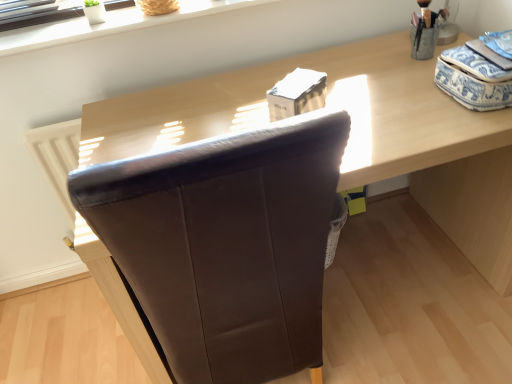
What are the coordinates of `free area below brown leather chair at center (from a real-world perspective)` in the screenshot? It's located at (382, 264).